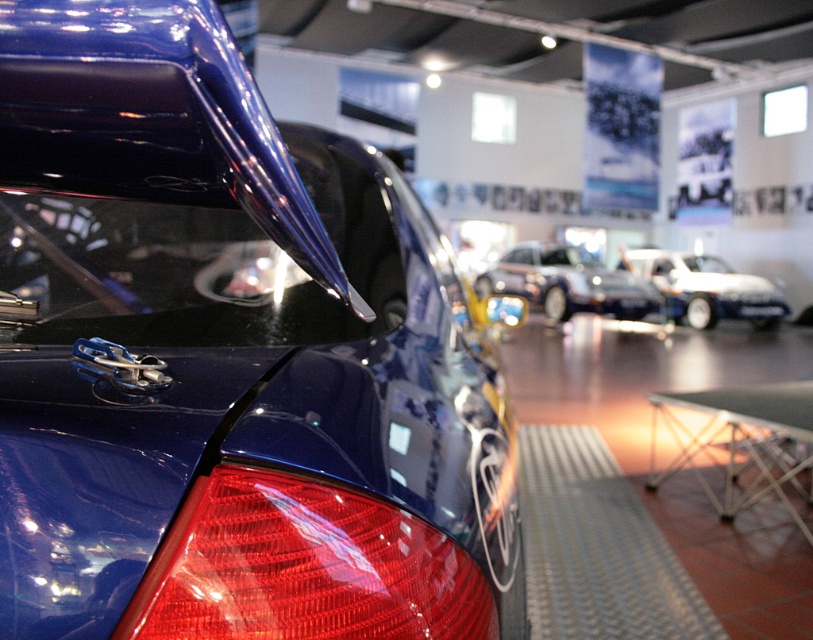
Measure the distance between glossy blue spoiler at upper left and camera.

The distance of glossy blue spoiler at upper left from camera is 17.96 inches.

Does glossy blue spoiler at upper left have a lesser height compared to black plastic license plate at center?

Yes.

In order to click on glossy blue spoiler at upper left in this screenshot , I will do `click(151, 118)`.

Does white glossy car at center have a lesser width compared to black plastic license plate at center?

No.

The image size is (813, 640). What are the coordinates of `white glossy car at center` in the screenshot? It's located at (701, 285).

The image size is (813, 640). In order to click on glossy blue spoiler at upper left in this screenshot , I will do `click(151, 118)`.

Between glossy blue spoiler at upper left and white glossy car at center, which one has more height?

Standing taller between the two is white glossy car at center.

Does point (44, 54) come in front of point (676, 301)?

Yes, it is in front of point (676, 301).

The image size is (813, 640). What are the coordinates of `glossy blue spoiler at upper left` in the screenshot? It's located at (151, 118).